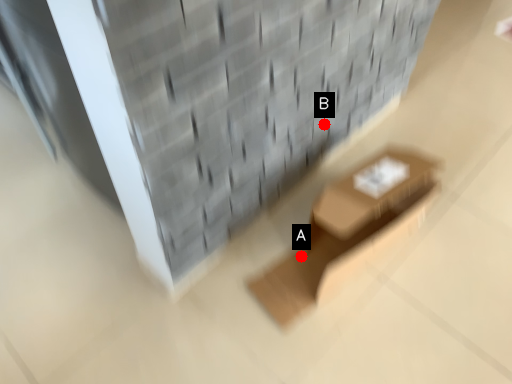
Question: Two points are circled on the image, labeled by A and B beside each circle. Which of the following is the farthest from the observer?

Choices:
 (A) A is further
 (B) B is further

Answer: (B)